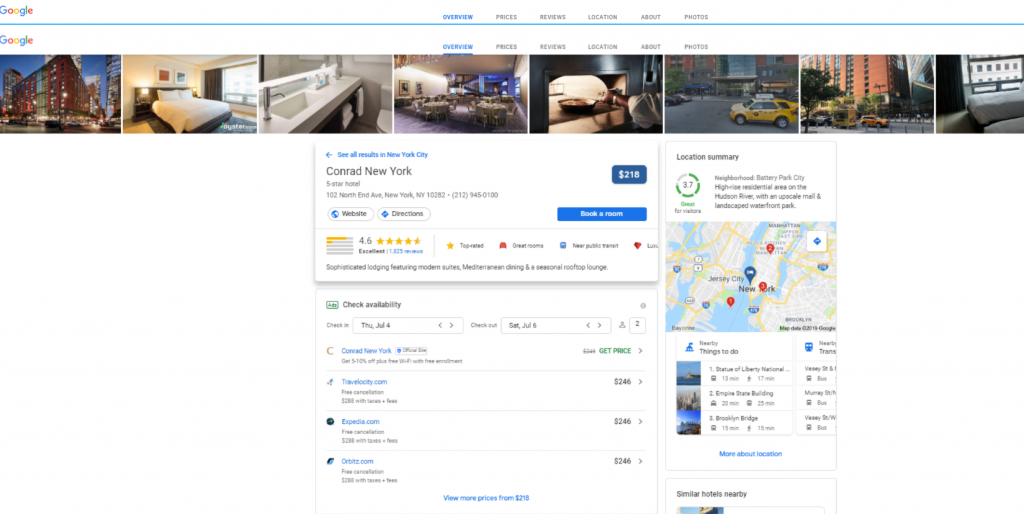
This screenshot has width=1024, height=514. Find the location of `sink`. sink is located at coordinates (296, 98).